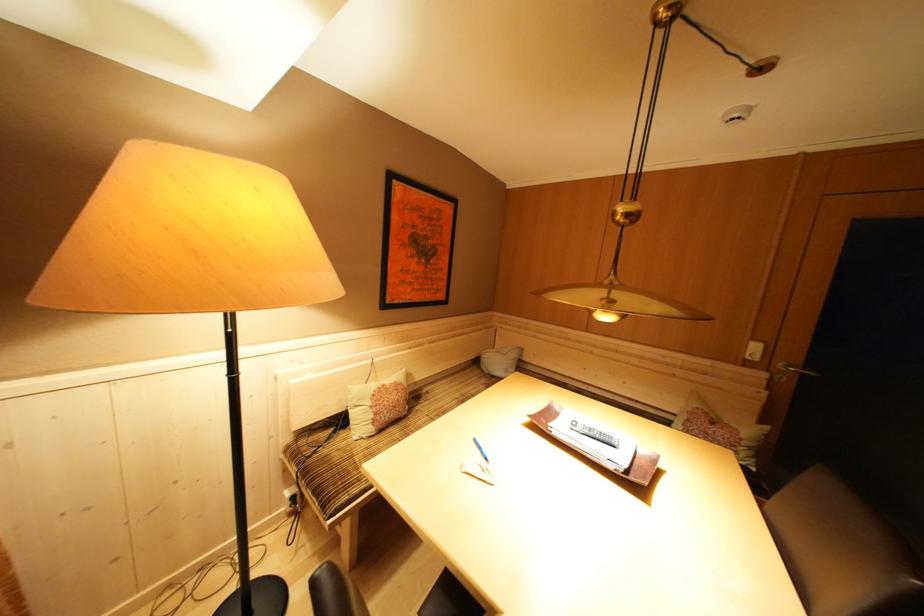
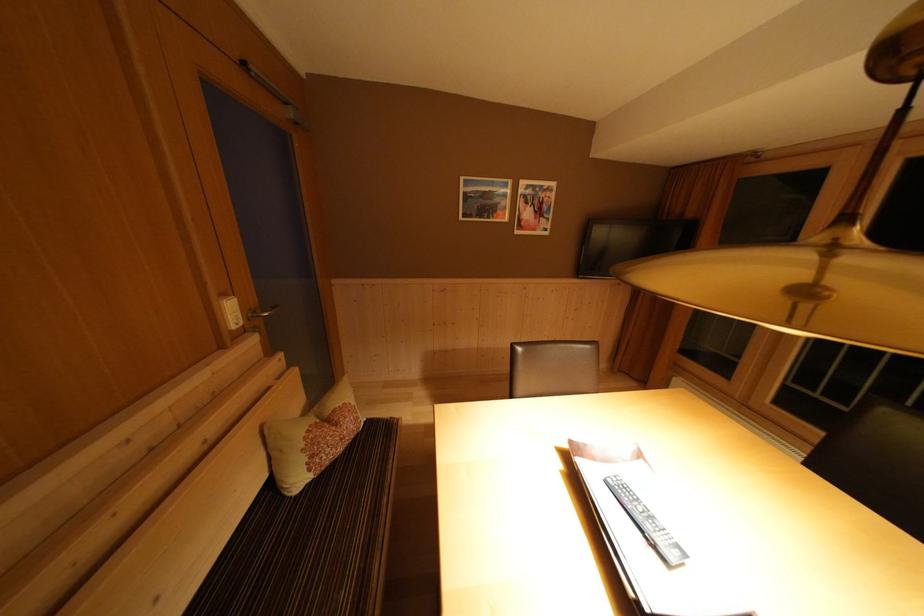
Locate, in the second image, the point that corresponds to [695,424] in the first image.

(319, 462)